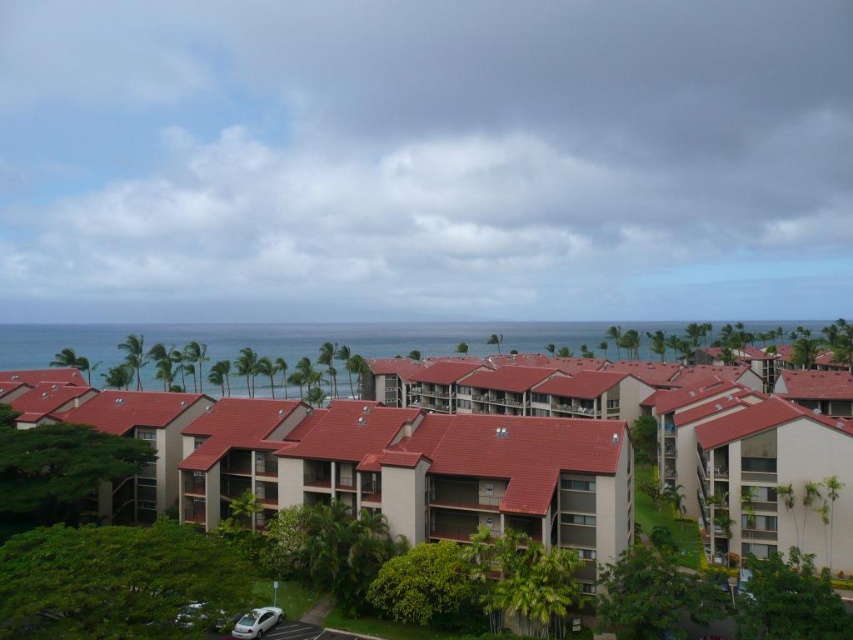
You are a delivery person trying to park your white matte car at lower center in the parking lot. There is another white matte car at lower left blocking your way. Based on their positions, can you park your car without moving the other car?

The white matte car at lower left is positioned on the right side of white matte car at lower center, so the white matte car at lower center is to the left of the other car. Since the other car is on the right side, you can park your car at lower center without moving the white matte car at lower left as there is space to the left.

You are a visitor arriving at the residential area and see the brown textured building at center and the white matte car at lower left. Which object is closer to you based on their positions?

The white matte car at lower left is behind the brown textured building at center, so the brown textured building at center is closer to you.

You are standing in the residential area and want to take a photo. There are two points of interest marked as point 1 at coordinates point [508,376] and point 2 at coordinates point [213,620]. Which point should you focus on first if you want to capture the closest object in your shot?

Point 1 at coordinates point [508,376] is further to the camera than point [213,620], so you should focus on point 2 first as it is closer to the camera and will appear larger in your photo.